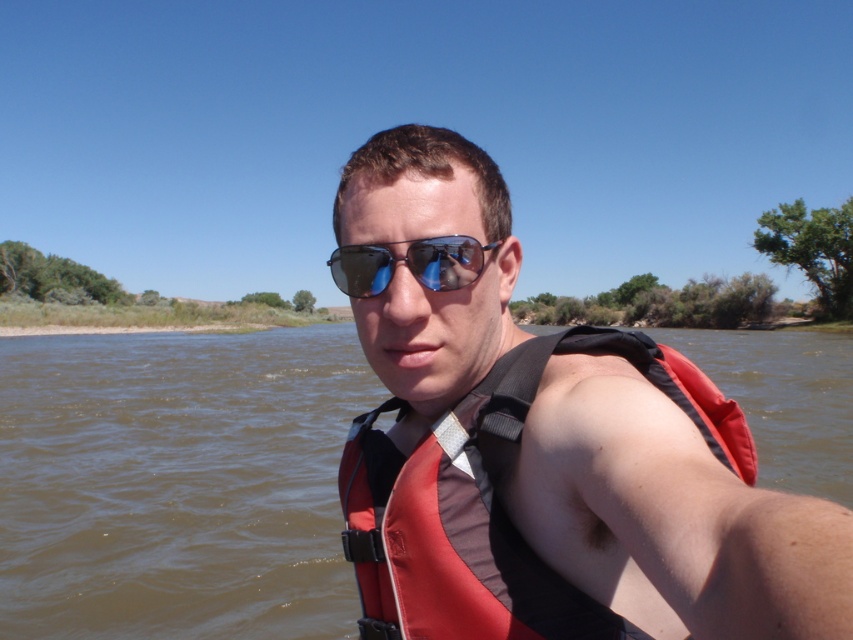
Question: Which point is closer to the camera?

Choices:
 (A) blue reflective lenses at center
 (B) red fabric life jacket at center
 (C) matte red life vest at center
 (D) brown matte water at center

Answer: (C)

Question: Does brown matte water at center appear under blue reflective lenses at center?

Choices:
 (A) no
 (B) yes

Answer: (A)

Question: Does matte red life vest at center lie in front of red fabric life jacket at center?

Choices:
 (A) no
 (B) yes

Answer: (B)

Question: Which object is positioned farthest from the red fabric life jacket at center?

Choices:
 (A) blue reflective lenses at center
 (B) brown matte water at center
 (C) matte red life vest at center

Answer: (B)

Question: Which object appears farthest from the camera in this image?

Choices:
 (A) matte red life vest at center
 (B) brown matte water at center
 (C) blue reflective lenses at center

Answer: (B)

Question: Is brown matte water at center thinner than red fabric life jacket at center?

Choices:
 (A) no
 (B) yes

Answer: (A)